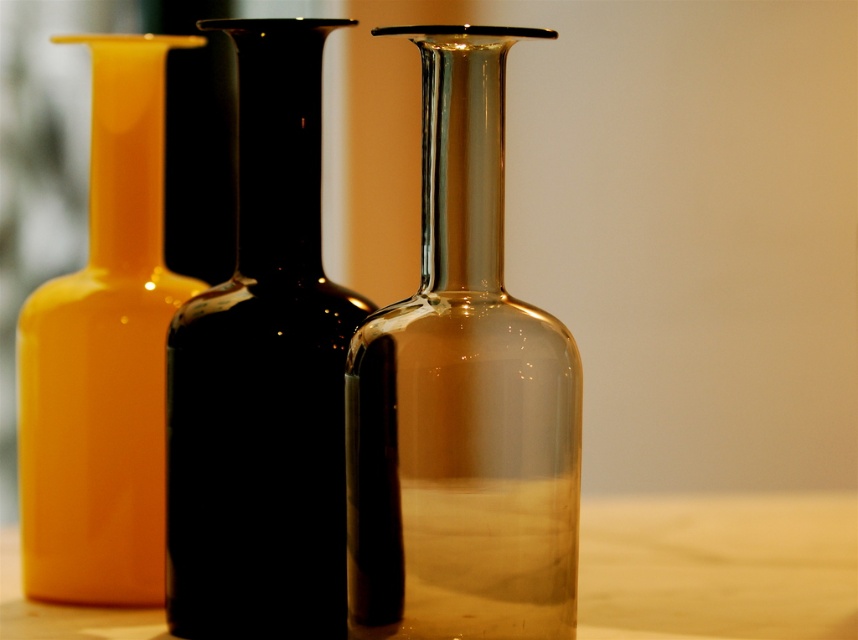
Is transparent glass bottle at center to the right of matte yellow vase at left from the viewer's perspective?

Indeed, transparent glass bottle at center is positioned on the right side of matte yellow vase at left.

Does transparent glass bottle at center appear on the left side of matte yellow vase at left?

In fact, transparent glass bottle at center is to the right of matte yellow vase at left.

Is point (391, 524) farther from camera compared to point (168, 273)?

No, (391, 524) is closer to viewer.

This screenshot has width=858, height=640. What are the coordinates of `transparent glass bottle at center` in the screenshot? It's located at (462, 396).

Does black glass bottle at center have a lesser height compared to matte yellow vase at left?

Correct, black glass bottle at center is not as tall as matte yellow vase at left.

Who is more forward, (198, 387) or (144, 442)?

Point (198, 387)

You are a GUI agent. You are given a task and a screenshot of the screen. Output one action in this format:
    pyautogui.click(x=<x>, y=<y>)
    Task: Click on the black glass bottle at center
    
    Given the screenshot: What is the action you would take?
    pyautogui.click(x=263, y=376)

Consider the image. Is black glass bottle at center smaller than wooden table at center?

Yes, black glass bottle at center is smaller than wooden table at center.

Locate an element on the screen. This screenshot has height=640, width=858. black glass bottle at center is located at coordinates (263, 376).